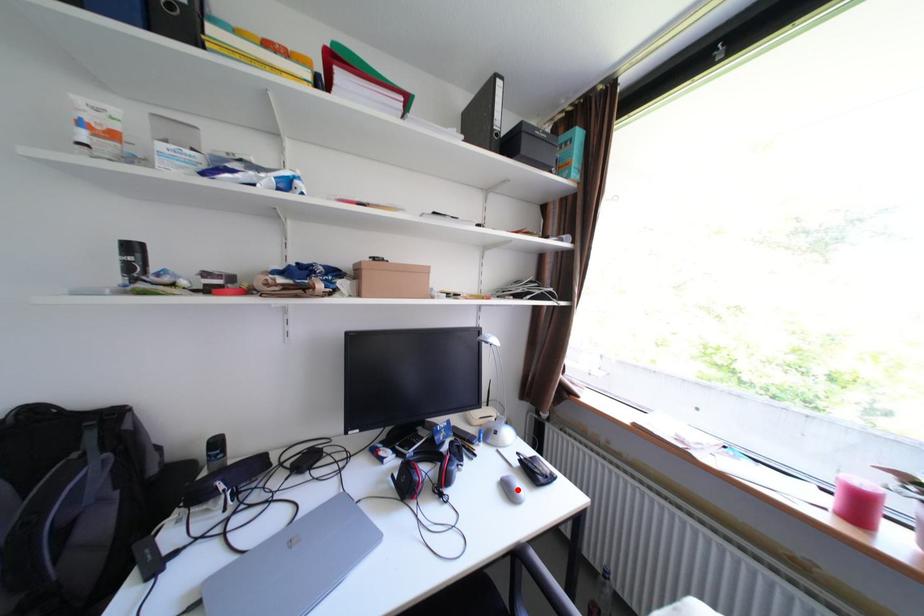
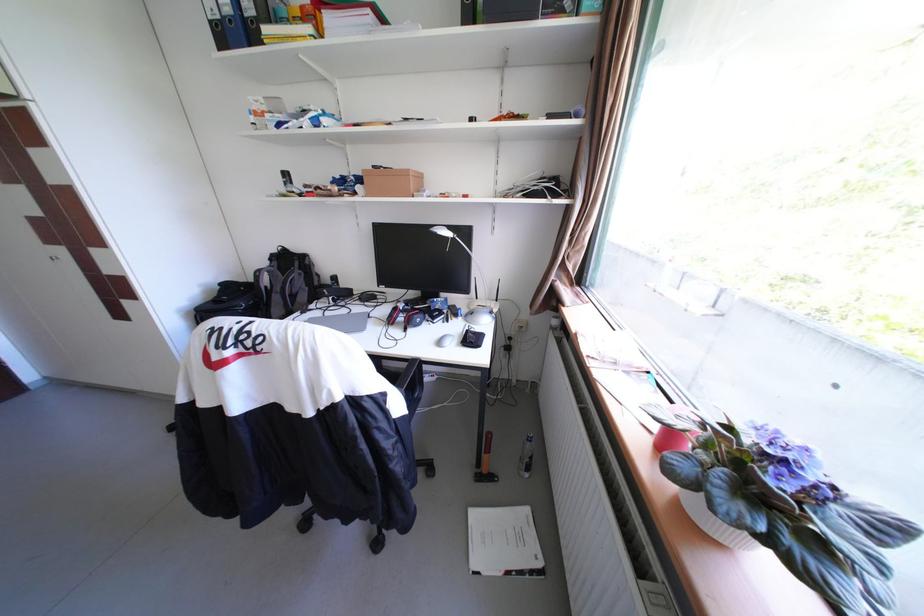
Question: I am providing you with two images of the same scene from different viewpoints. A red point is marked on the first image. Can you still see the location of the red point in image 2?

Choices:
 (A) Yes
 (B) No

Answer: (B)